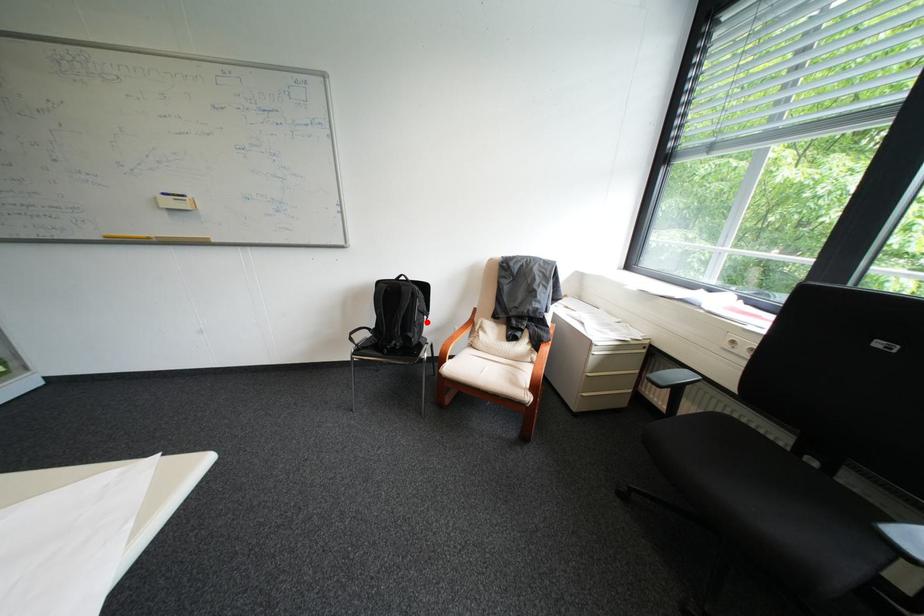
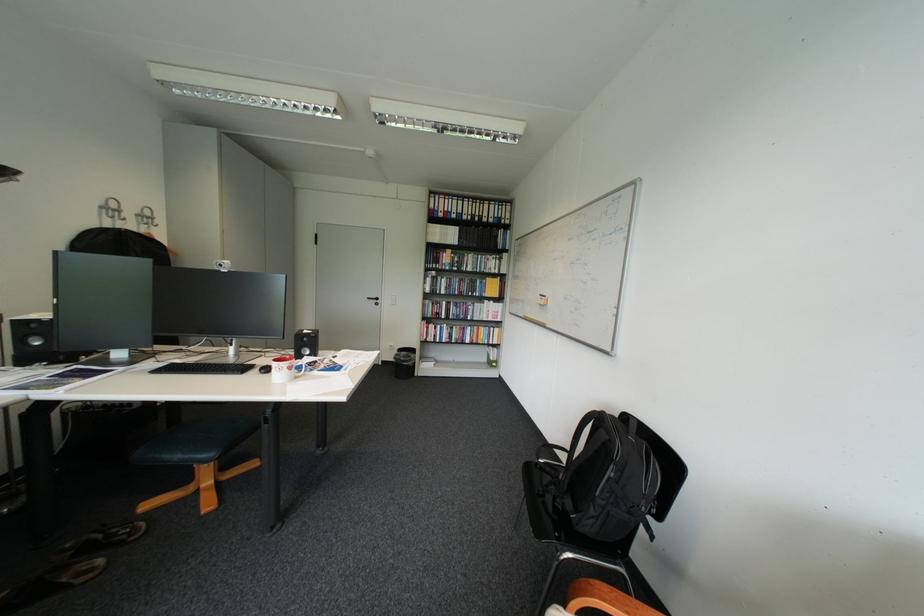
Question: I am providing you with two images of the same scene from different viewpoints. In image1, a red point is highlighted. Considering the same 3D point in image2, which of the following is correct?

Choices:
 (A) It is closer
 (B) It is farther

Answer: (B)